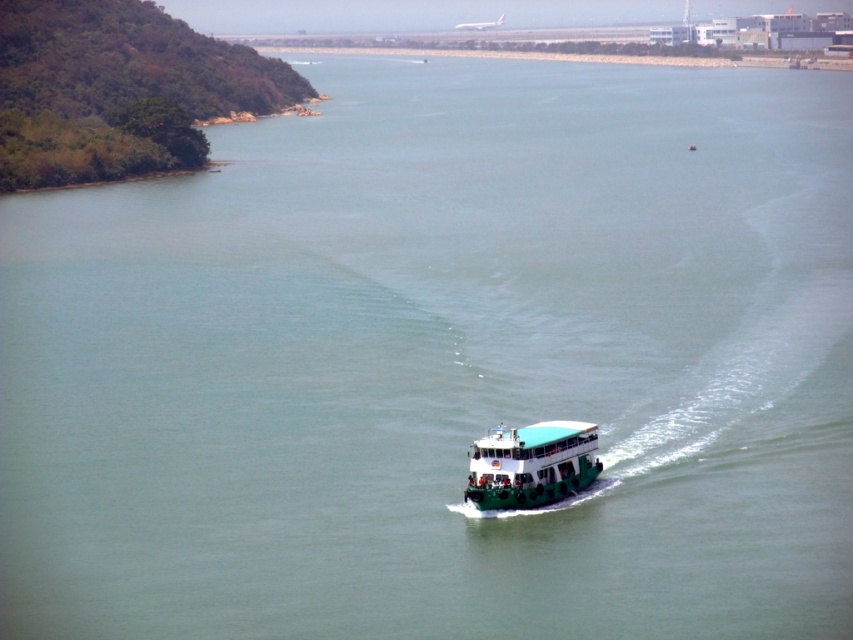
Question: Which of the following is the farthest from the observer?

Choices:
 (A) green matte ferry at center
 (B) concrete wall at upper center

Answer: (B)

Question: Which point appears closest to the camera in this image?

Choices:
 (A) (463, 490)
 (B) (851, 65)

Answer: (A)

Question: Where is green matte ferry at center located in relation to concrete wall at upper center in the image?

Choices:
 (A) below
 (B) above

Answer: (A)

Question: Does green matte ferry at center appear under concrete wall at upper center?

Choices:
 (A) no
 (B) yes

Answer: (B)

Question: Which point is closer to the camera?

Choices:
 (A) (485, 460)
 (B) (680, 60)

Answer: (A)

Question: Is green matte ferry at center positioned at the back of concrete wall at upper center?

Choices:
 (A) yes
 (B) no

Answer: (B)